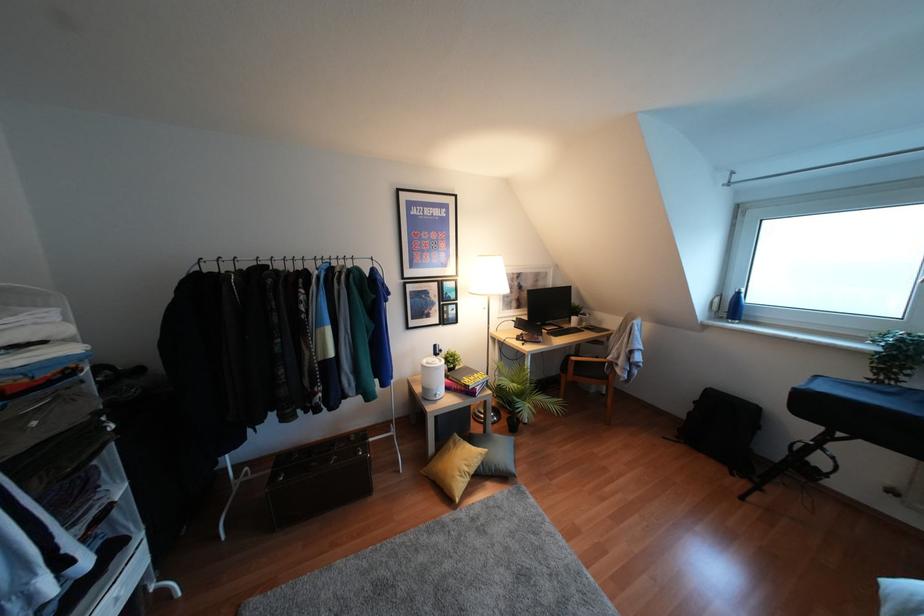
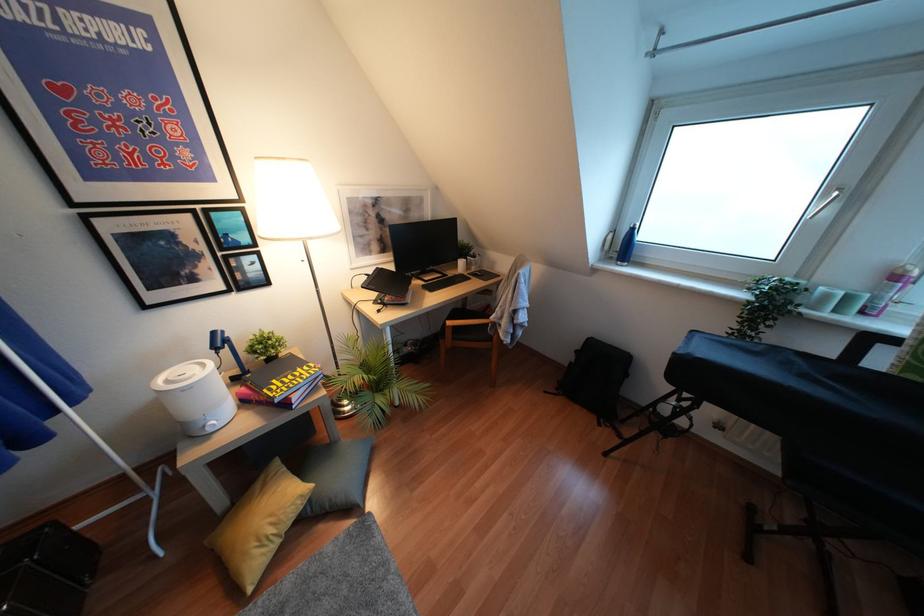
The images are taken continuously from a first-person perspective. In which direction are you moving?

The movement direction of the cameraman is right, forward.